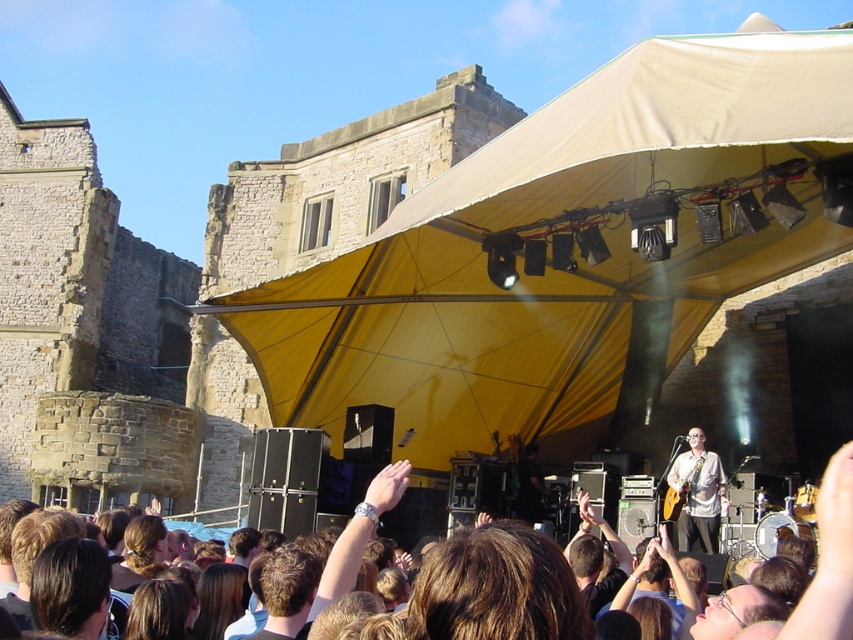
You are a stagehand at the outdoor concert. You need to secure the light brown wood guitar at center from rain. Since the yellow fabric canopy at upper center is above it, can you use the canopy to protect the guitar from rain?

The yellow fabric canopy at upper center is positioned over the light brown wood guitar at center, so yes, the canopy can be used to protect the guitar from rain as it is directly above it.

Based on the scene description, where is the yellow fabric canopy at upper center located in the image?

The yellow fabric canopy at upper center is located at point [567,248].

You are standing at the center of the stage and want to walk to the nearest point between point (280, 298) and point (698, 464). Which point should you head towards?

You should head towards point (280, 298) because it is closer to you than point (698, 464).